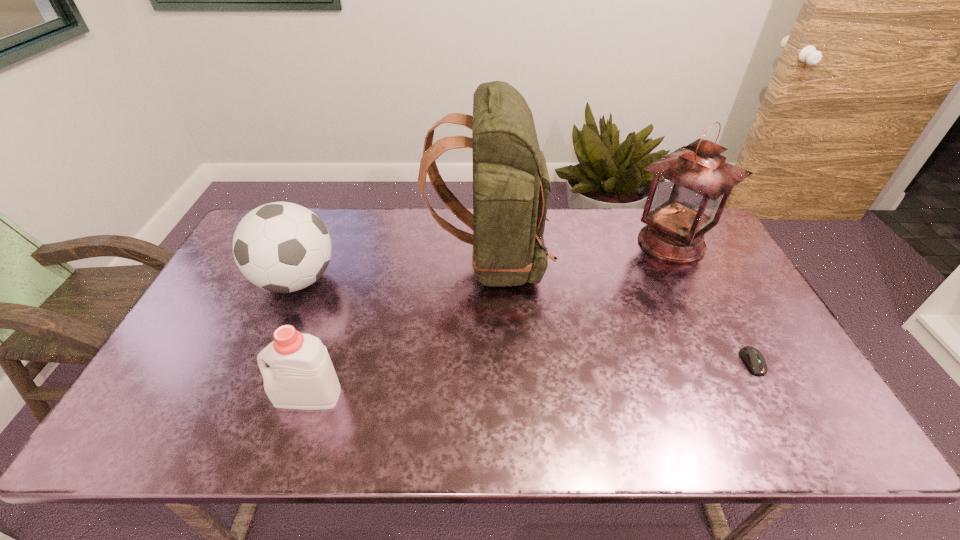
Find the location of a particular element. The image size is (960, 540). the third object from left to right is located at coordinates (511, 187).

Identify the location of the tallest object. (511, 187).

Identify the location of the fourth shortest object. The image size is (960, 540). (690, 188).

At what (x,y) coordinates should I click in order to perform the action: click on soccer ball. Please return your answer as a coordinate pair (x, y). This screenshot has width=960, height=540. Looking at the image, I should click on (281, 247).

Image resolution: width=960 pixels, height=540 pixels. Find the location of `detergent`. detergent is located at coordinates (301, 376).

I want to click on the shortest object, so click(x=752, y=356).

Find the location of `computer equipment`. computer equipment is located at coordinates (752, 356).

You are a GUI agent. You are given a task and a screenshot of the screen. Output one action in this format:
    pyautogui.click(x=<x>, y=<y>)
    Task: Click on the free region located 0.160m on the back of the backpack
    The image size is (960, 540).
    Given the screenshot: What is the action you would take?
    pyautogui.click(x=379, y=261)

Find the location of `free region located 0.130m on the back of the backpack`. free region located 0.130m on the back of the backpack is located at coordinates (389, 261).

Where is `free location located on the back of the backpack`? The image size is (960, 540). free location located on the back of the backpack is located at coordinates (370, 261).